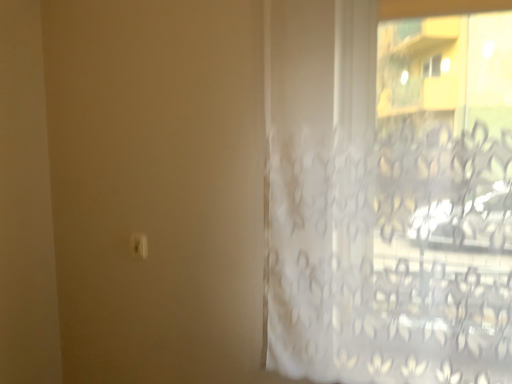
This screenshot has height=384, width=512. In order to click on silver metallic door handle at lower left in this screenshot , I will do `click(139, 245)`.

What do you see at coordinates (139, 245) in the screenshot? I see `silver metallic door handle at lower left` at bounding box center [139, 245].

Locate an element on the screen. silver metallic door handle at lower left is located at coordinates (139, 245).